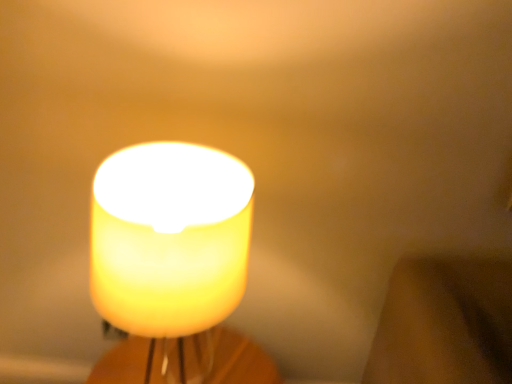
Locate an element on the screen. translucent glass candle at center is located at coordinates (240, 360).

This screenshot has height=384, width=512. What do you see at coordinates (240, 360) in the screenshot?
I see `translucent glass candle at center` at bounding box center [240, 360].

This screenshot has width=512, height=384. Find the location of `translucent yellow candle at center`. translucent yellow candle at center is located at coordinates (169, 238).

This screenshot has height=384, width=512. What do you see at coordinates (169, 238) in the screenshot?
I see `translucent yellow candle at center` at bounding box center [169, 238].

Identify the location of translucent glass candle at center. This screenshot has height=384, width=512. (240, 360).

Visually, is translucent glass candle at center positioned to the left or to the right of translucent yellow candle at center?

Clearly, translucent glass candle at center is on the left of translucent yellow candle at center in the image.

Based on the photo, in the image, is translucent glass candle at center positioned in front of or behind translucent yellow candle at center?

translucent glass candle at center is positioned farther from the viewer than translucent yellow candle at center.

Which is less distant, (277, 377) or (246, 272)?

Point (277, 377) is farther from the camera than point (246, 272).

From the image's perspective, is translucent glass candle at center located above translucent yellow candle at center?

No, from the image's perspective, translucent glass candle at center is not over translucent yellow candle at center.

From a real-world perspective, which is physically below, translucent glass candle at center or translucent yellow candle at center?

In real-world perspective, translucent glass candle at center is lower.

Between translucent glass candle at center and translucent yellow candle at center, which one has larger width?

translucent yellow candle at center is wider.

Considering the sizes of objects translucent glass candle at center and translucent yellow candle at center in the image provided, who is taller, translucent glass candle at center or translucent yellow candle at center?

Standing taller between the two is translucent yellow candle at center.

Can you confirm if translucent glass candle at center is bigger than translucent yellow candle at center?

No.

Is translucent glass candle at center inside the boundaries of translucent yellow candle at center, or outside?

translucent glass candle at center is located beyond the bounds of translucent yellow candle at center.

Does translucent glass candle at center touch translucent yellow candle at center?

translucent glass candle at center is not next to translucent yellow candle at center, and they're not touching.

Is translucent glass candle at center facing towards translucent yellow candle at center?

No, translucent glass candle at center is not turned towards translucent yellow candle at center.

Find the location of `candle holder below the translucent yellow candle at center (from a real-world perspective)`. candle holder below the translucent yellow candle at center (from a real-world perspective) is located at coordinates click(x=240, y=360).

Between translucent yellow candle at center and translucent glass candle at center, which one appears on the right side from the viewer's perspective?

From the viewer's perspective, translucent yellow candle at center appears more on the right side.

Is the position of translucent yellow candle at center more distant than that of translucent glass candle at center?

No, translucent yellow candle at center is closer to the camera.

Is point (147, 238) closer to viewer compared to point (216, 353)?

Yes, it is.

From the image's perspective, does translucent yellow candle at center appear lower than translucent glass candle at center?

No, from the image's perspective, translucent yellow candle at center is not below translucent glass candle at center.

From a real-world perspective, between translucent yellow candle at center and translucent glass candle at center, who is vertically lower?

In real-world perspective, translucent glass candle at center is lower.

In terms of width, does translucent yellow candle at center look wider or thinner when compared to translucent glass candle at center?

A: translucent yellow candle at center is wider than translucent glass candle at center.

Considering the relative sizes of translucent yellow candle at center and translucent glass candle at center in the image provided, is translucent yellow candle at center taller than translucent glass candle at center?

Correct, translucent yellow candle at center is much taller as translucent glass candle at center.

Between translucent yellow candle at center and translucent glass candle at center, which one has larger size?

translucent yellow candle at center.

Choose the correct answer: Is translucent yellow candle at center inside translucent glass candle at center or outside it?

translucent yellow candle at center exists outside the volume of translucent glass candle at center.

Is translucent yellow candle at center with translucent glass candle at center?

translucent yellow candle at center and translucent glass candle at center are clearly separated.

Based on the photo, is translucent yellow candle at center looking in the opposite direction of translucent glass candle at center?

No.

What's the angular difference between translucent yellow candle at center and translucent glass candle at center's facing directions?

translucent yellow candle at center and translucent glass candle at center are facing 0.768 degrees away from each other.

The height and width of the screenshot is (384, 512). Find the location of `candle holder that appears below the translucent yellow candle at center (from the image's perspective)`. candle holder that appears below the translucent yellow candle at center (from the image's perspective) is located at coordinates (240, 360).

Find the location of a particular element. candle that appears above the translucent glass candle at center (from a real-world perspective) is located at coordinates (169, 238).

Find the location of `candle above the translucent glass candle at center (from the image's perspective)`. candle above the translucent glass candle at center (from the image's perspective) is located at coordinates (169, 238).